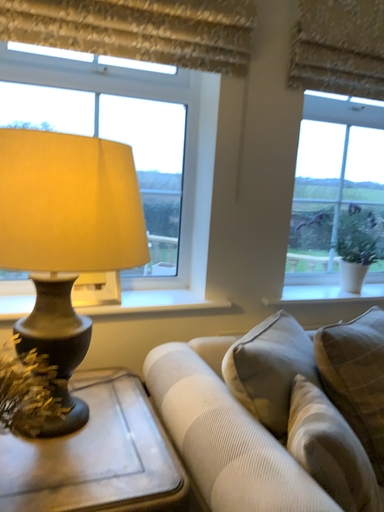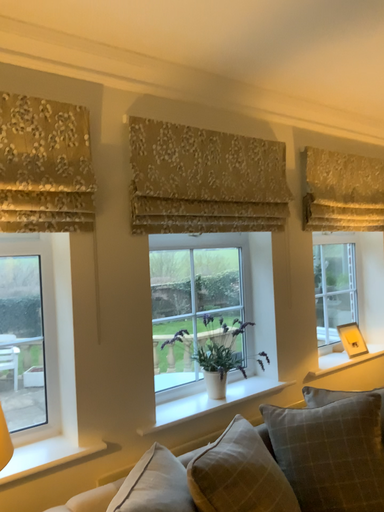
Question: How did the camera likely rotate when shooting the video?

Choices:
 (A) rotated left
 (B) rotated right

Answer: (B)